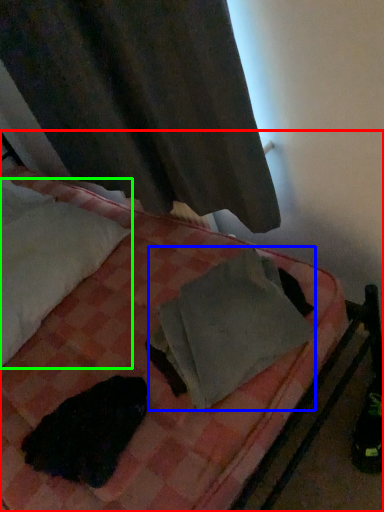
Question: Which object is the farthest from bed (highlighted by a red box)? Choose among these: material (highlighted by a blue box) or pillow (highlighted by a green box).

Choices:
 (A) material
 (B) pillow

Answer: (B)